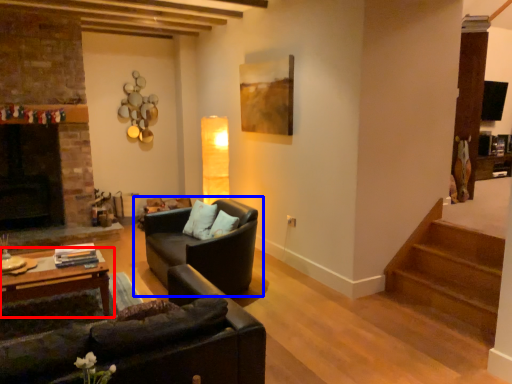
Question: Which object appears farthest to the camera in this image, table (highlighted by a red box) or studio couch (highlighted by a blue box)?

Choices:
 (A) table
 (B) studio couch

Answer: (B)